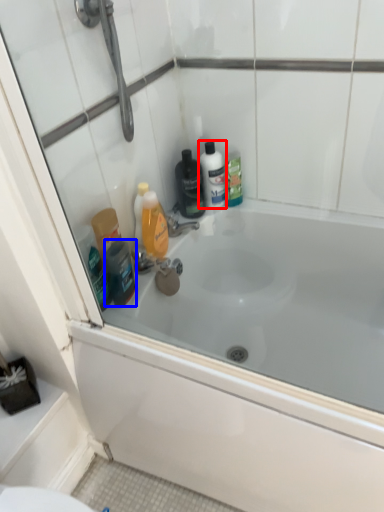
Question: Which of the following is the closest to the observer, mouthwash (highlighted by a red box) or toiletry (highlighted by a blue box)?

Choices:
 (A) mouthwash
 (B) toiletry

Answer: (B)